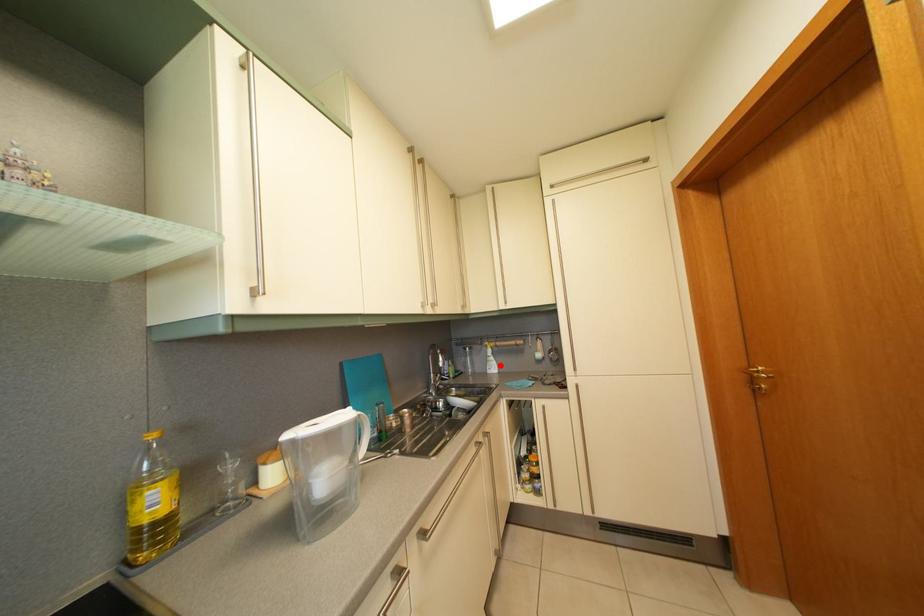
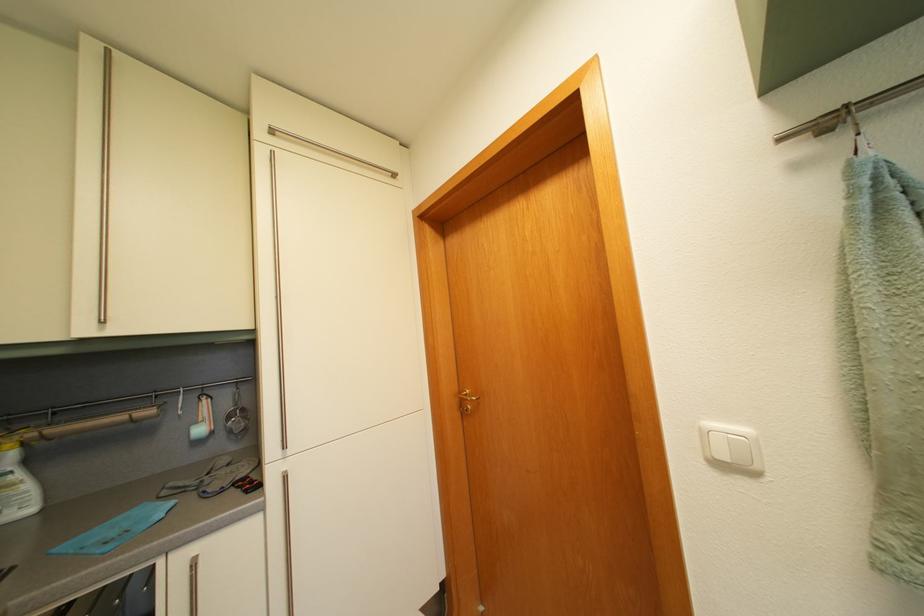
Locate, in the second image, the point that corresponds to the highlighted location in the first image.

(26, 484)